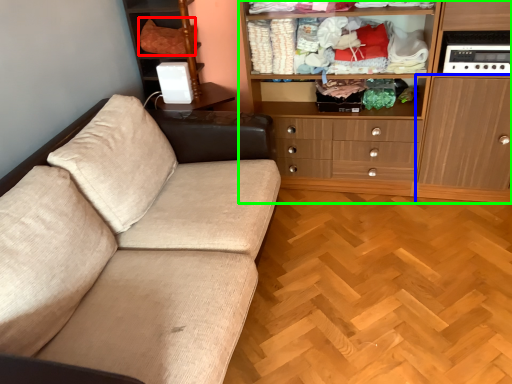
Question: Considering the real-world distances, which object is closest to clothing (highlighted by a red box)? cabinetry (highlighted by a blue box) or cabinetry (highlighted by a green box).

Choices:
 (A) cabinetry
 (B) cabinetry

Answer: (B)